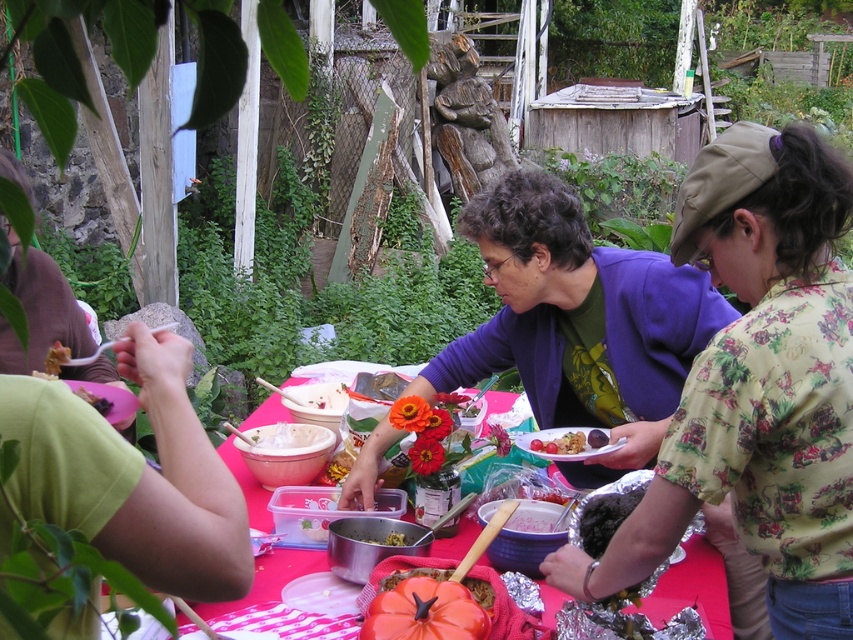
You are at the table and want to grab the smooth chocolate cake at center. Which direction should you move relative to the matte brown bread at lower left?

You should move to the right of the matte brown bread at lower left to reach the smooth chocolate cake at center since the matte brown bread at lower left is to the left of smooth chocolate cake at center.

You are at the outdoor gathering and want to grab bread before serving yourself. Which object should you look for first, the shiny metallic bowl at center or the matte brown bread at lower left?

The matte brown bread at lower left is located above the shiny metallic bowl at center, so you should look for the matte brown bread at lower left first.

What object is located at the coordinates point (94, 401) in the image?

The point (94, 401) corresponds to the matte brown bread at lower left.